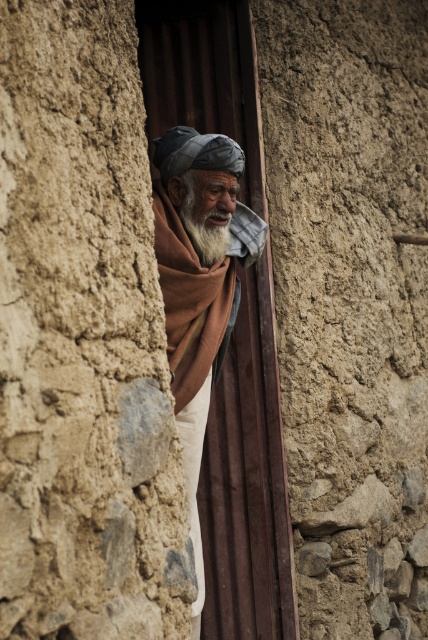
Question: Among these points, which one is farthest from the camera?

Choices:
 (A) (208, 307)
 (B) (228, 227)
 (C) (223, 212)

Answer: (A)

Question: Is the position of brown woven scarf at center less distant than that of white soft beard at center?

Choices:
 (A) yes
 (B) no

Answer: (A)

Question: Does brown woolen scarf at center appear over white soft beard at center?

Choices:
 (A) no
 (B) yes

Answer: (A)

Question: Which object is positioned closest to the brown woolen scarf at center?

Choices:
 (A) white soft beard at center
 (B) brown woven scarf at center

Answer: (B)

Question: Does brown woolen scarf at center have a lesser width compared to brown woven scarf at center?

Choices:
 (A) no
 (B) yes

Answer: (A)

Question: Which of the following is the closest to the observer?

Choices:
 (A) [214, 209]
 (B) [205, 266]
 (C) [229, 304]

Answer: (A)